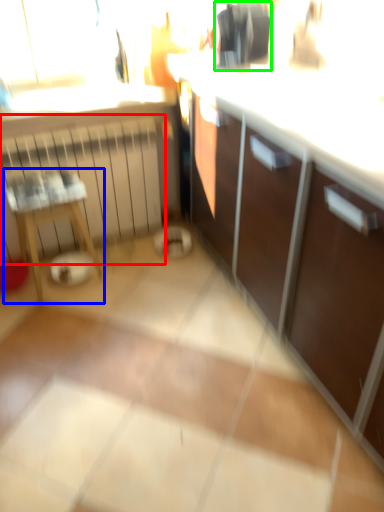
Question: Based on their relative distances, which object is farther from radiator (highlighted by a red box)? Choose from furniture (highlighted by a blue box) and appliance (highlighted by a green box).

Choices:
 (A) furniture
 (B) appliance

Answer: (B)